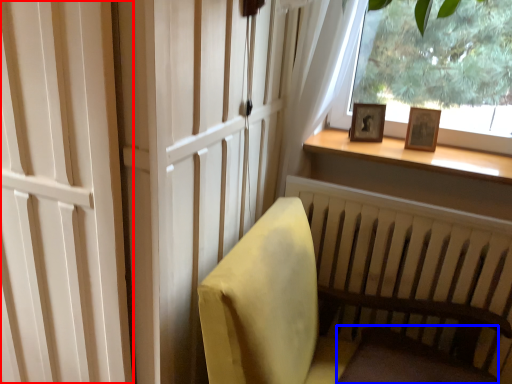
Question: Which of the following is the closest to the observer, screen door (highlighted by a red box) or footrest (highlighted by a blue box)?

Choices:
 (A) screen door
 (B) footrest

Answer: (A)